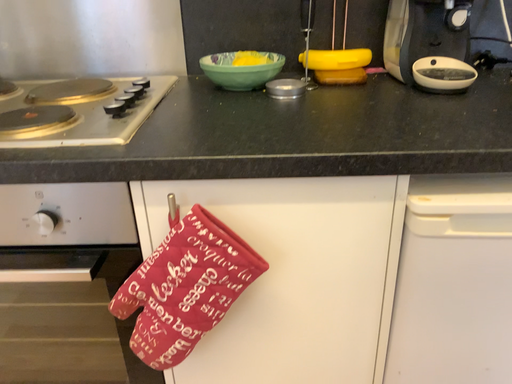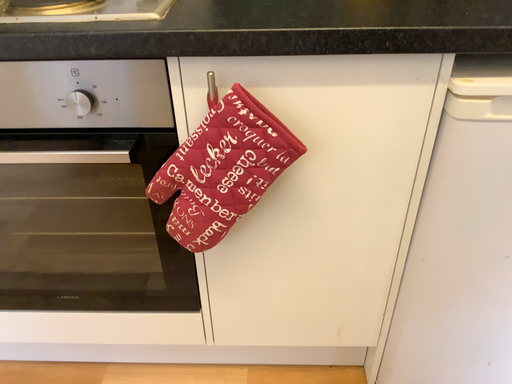
Question: Which way did the camera rotate in the video?

Choices:
 (A) rotated downward
 (B) rotated upward

Answer: (A)